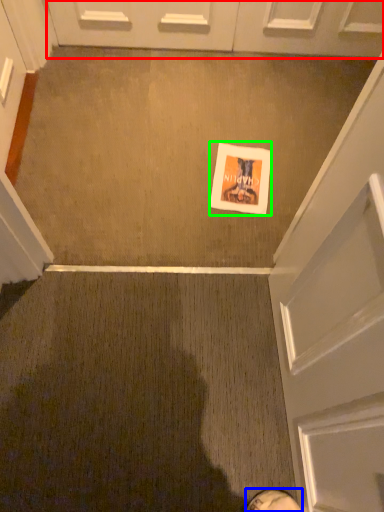
Question: Which object is the closest to the door (highlighted by a red box)? Choose among these: footwear (highlighted by a blue box) or flyer (highlighted by a green box).

Choices:
 (A) footwear
 (B) flyer

Answer: (B)